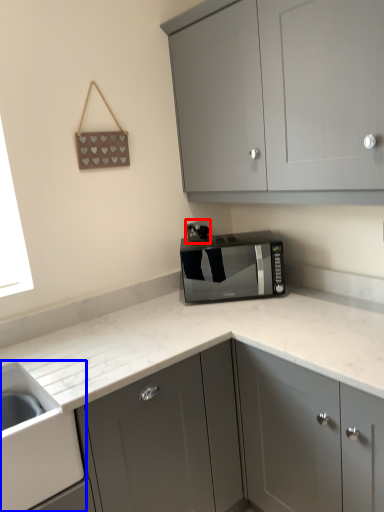
Question: Which point is further to the camera, electric outlet (highlighted by a red box) or sink (highlighted by a blue box)?

Choices:
 (A) electric outlet
 (B) sink

Answer: (A)